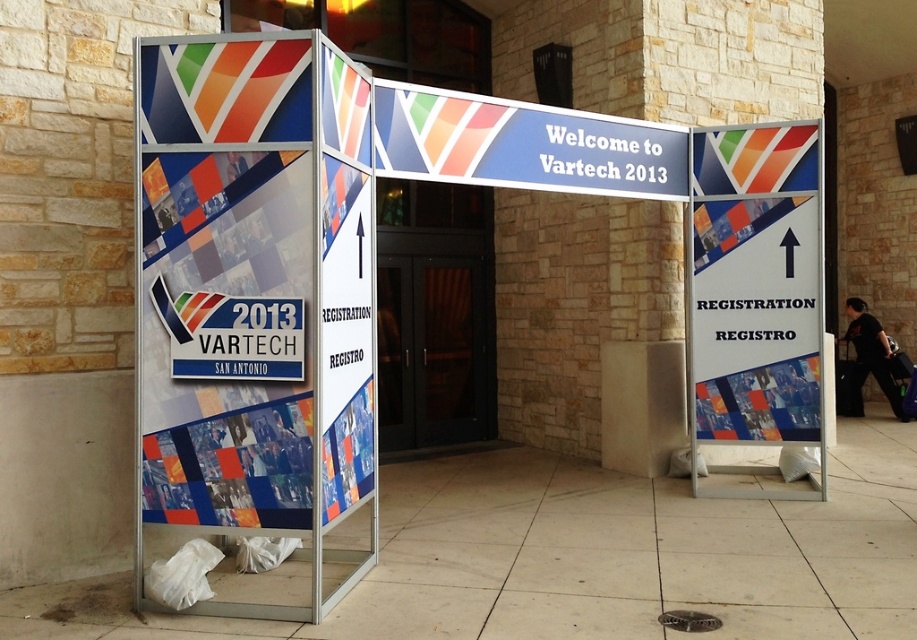
Looking at this image, you are standing in front of the three signs at the building entrance. You need to locate the matte plastic sign at center and the white plastic sign at center. According to the scene description, which one is positioned lower?

The matte plastic sign at center is located below the white plastic sign at center, so the matte plastic sign at center is positioned lower.

You are standing at the entrance of the building and see two points marked on the signs. The first point is at coordinates point (252, 480) and the second is at point (772, 216). Which point is closer to you?

Point (252, 480) is closer to the viewer than point (772, 216).

You are standing in front of the three signs mentioned. You need to locate the matte plastic sign at center and the blue glossy sign at center. According to their positions, which one is lower?

The matte plastic sign at center is below the blue glossy sign at center, so the matte plastic sign at center is lower.